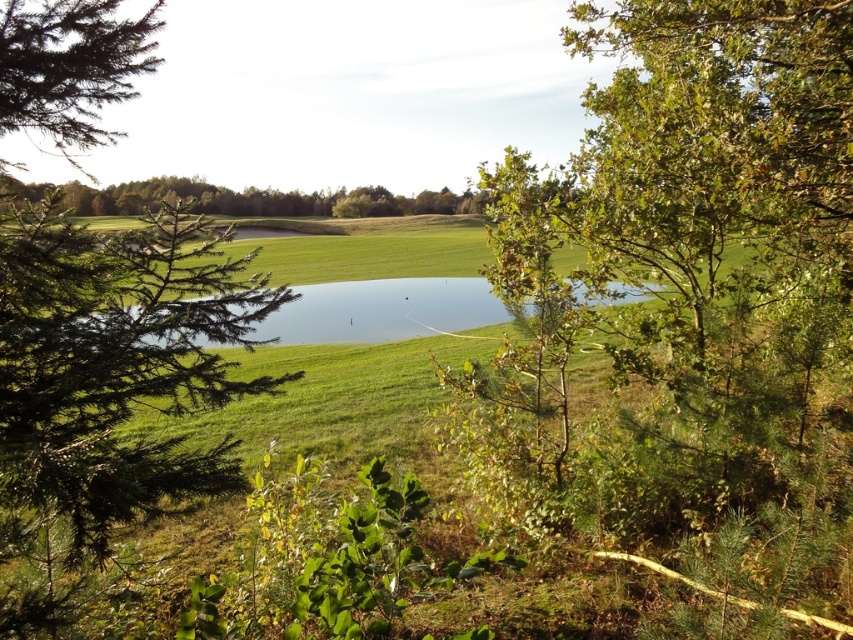
Who is lower down, green needle-like tree at left or clear water at center?

green needle-like tree at left

Between green needle-like tree at left and clear water at center, which one appears on the left side from the viewer's perspective?

green needle-like tree at left is more to the left.

The height and width of the screenshot is (640, 853). In order to click on green needle-like tree at left in this screenshot , I will do `click(111, 371)`.

Between point (9, 88) and point (288, 332), which one is positioned in front?

Point (9, 88) is more forward.

Is green needle-like at upper left in front of clear water at center?

Yes, it is.

Where is `green needle-like at upper left`? green needle-like at upper left is located at coordinates (70, 67).

Is green needle-like tree at left positioned before green needle-like at upper left?

No, green needle-like tree at left is behind green needle-like at upper left.

How much distance is there between green needle-like tree at left and green needle-like at upper left?

green needle-like tree at left is 26.52 inches from green needle-like at upper left.

Who is more forward, (0, 241) or (74, 42)?

Point (74, 42)

Locate an element on the screen. green needle-like tree at left is located at coordinates (111, 371).